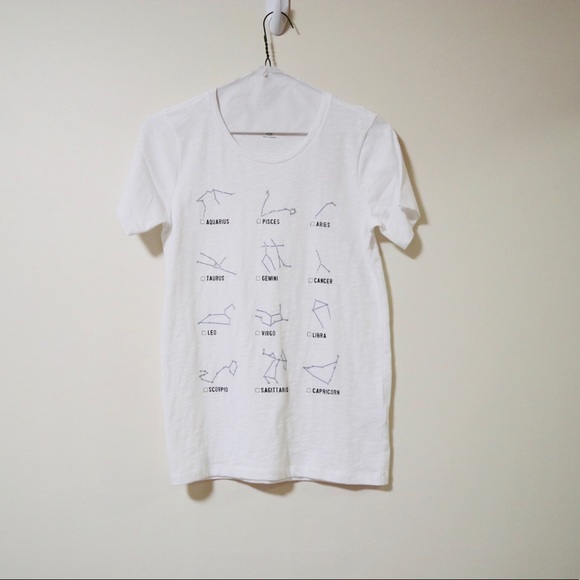
The image size is (580, 580). I want to click on hanger, so click(x=238, y=79), click(x=298, y=79).